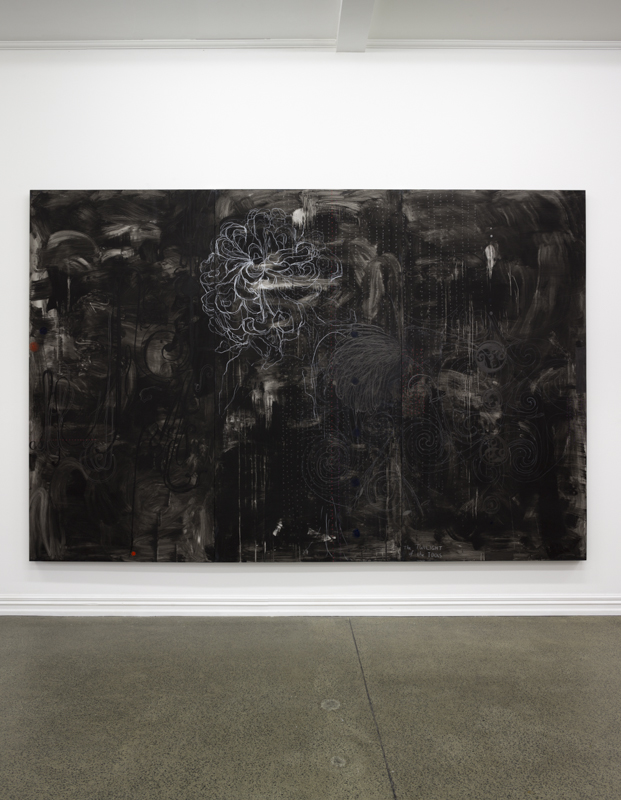
This screenshot has height=800, width=621. I want to click on painting on wall, so click(197, 205), click(197, 466).